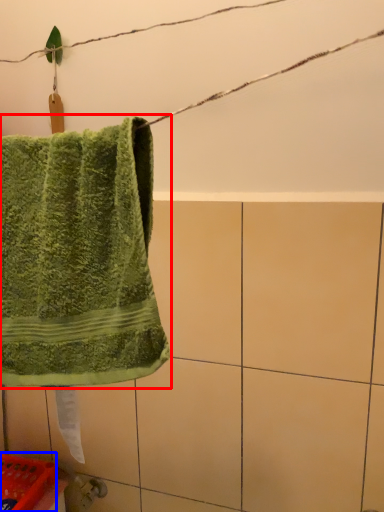
Question: Which object appears closest to the camera in this image, towel (highlighted by a red box) or basket (highlighted by a blue box)?

Choices:
 (A) towel
 (B) basket

Answer: (A)